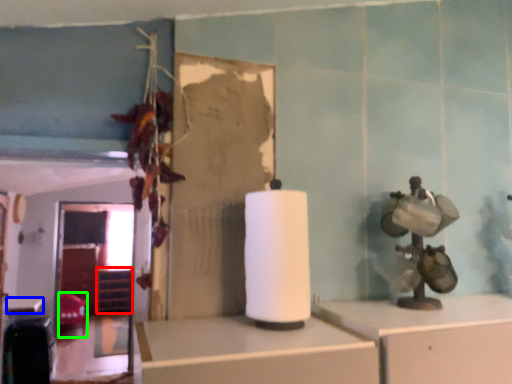
Question: Estimate the real-world distances between objects in this image. Which object is closer to shelf (highlighted by a red box), table (highlighted by a blue box) or chair (highlighted by a green box)?

Choices:
 (A) table
 (B) chair

Answer: (B)